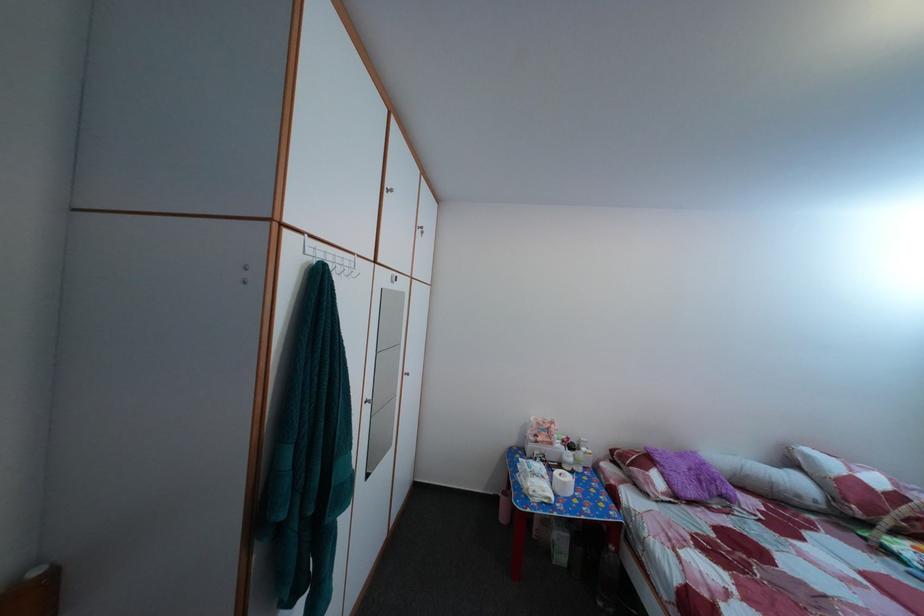
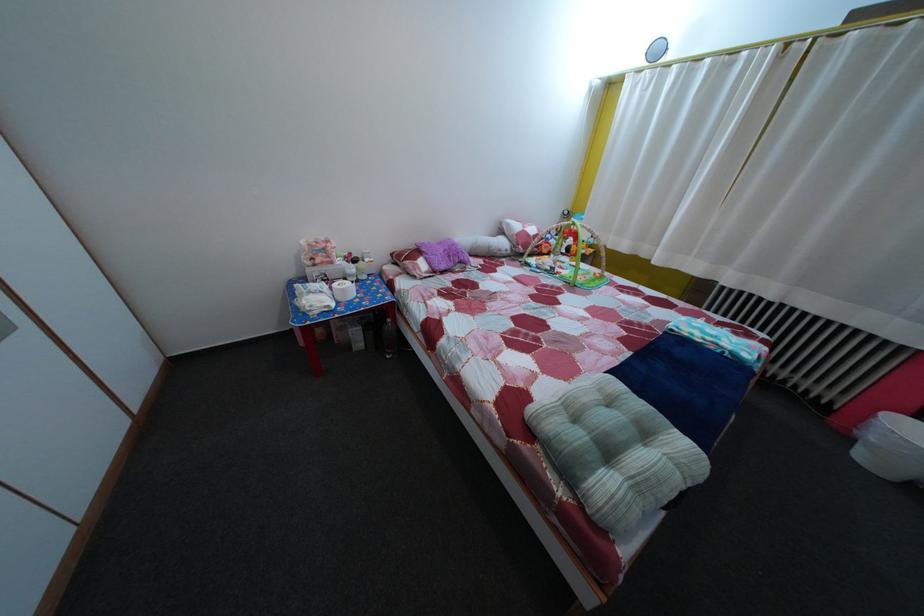
Locate, in the second image, the point that corresponds to point 689,464 in the first image.

(450, 252)